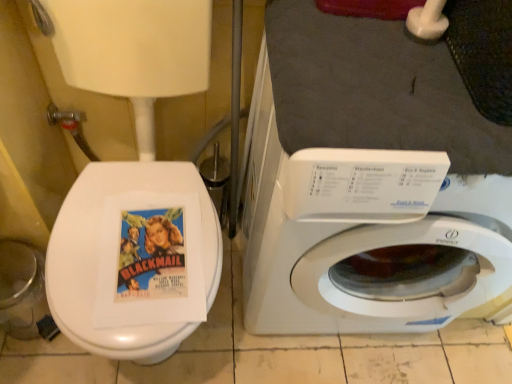
Where is `blank space situated above white plastic washing machine at center (from a real-world perspective)`? blank space situated above white plastic washing machine at center (from a real-world perspective) is located at coordinates (407, 84).